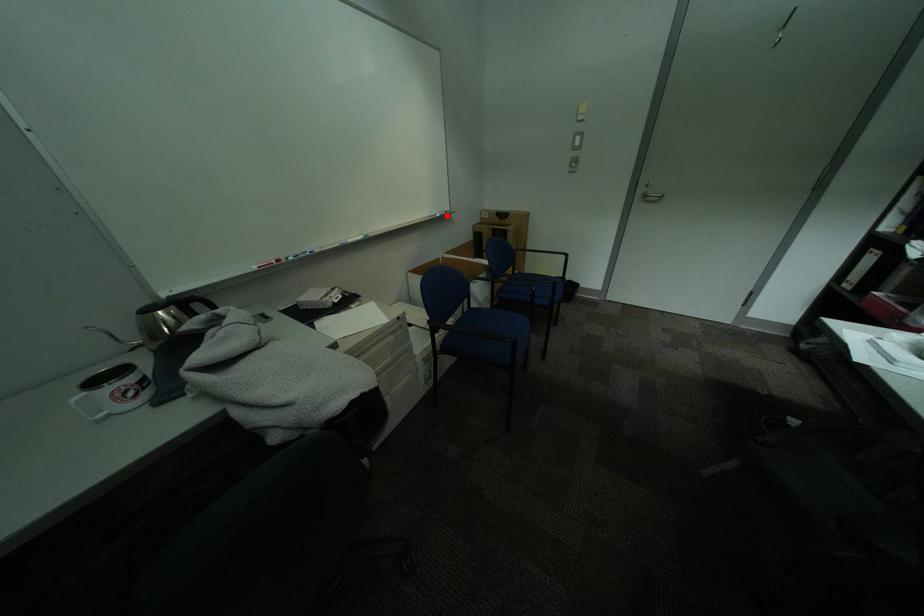
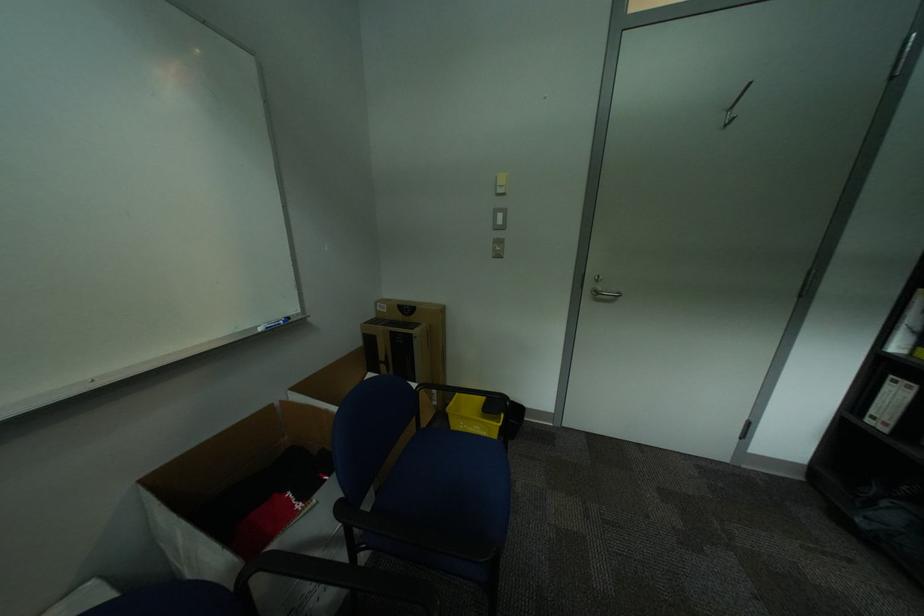
Question: I am providing you with two images of the same scene from different viewpoints. In image1, a red point is highlighted. Considering the same 3D point in image2, which of the following is correct?

Choices:
 (A) It is closer
 (B) It is farther

Answer: (B)